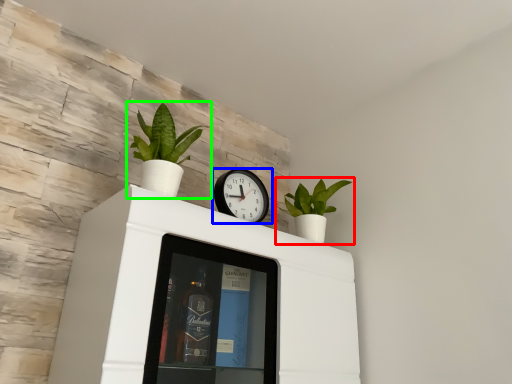
Question: Considering the real-world distances, which object is farthest from houseplant (highlighted by a red box)? wall clock (highlighted by a blue box) or houseplant (highlighted by a green box)?

Choices:
 (A) wall clock
 (B) houseplant

Answer: (B)